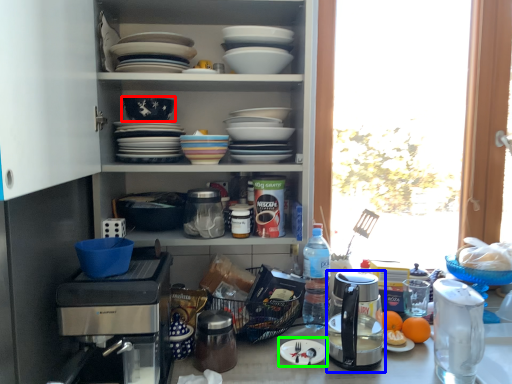
Question: Considering the real-world distances, which object is closest to bowl (highlighted by a red box)? kitchen appliance (highlighted by a blue box) or paper plate (highlighted by a green box).

Choices:
 (A) kitchen appliance
 (B) paper plate

Answer: (B)